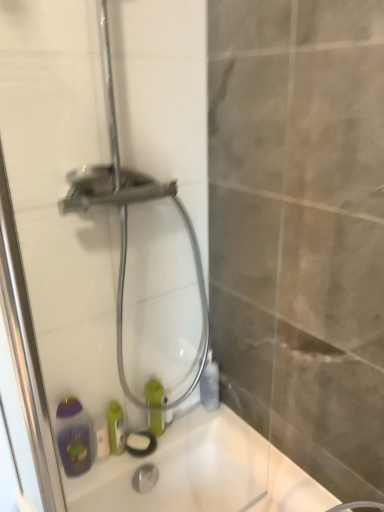
This screenshot has width=384, height=512. I want to click on free space to the left of matte gray bottle at right, the second bottle when ordered from left to right, so click(189, 413).